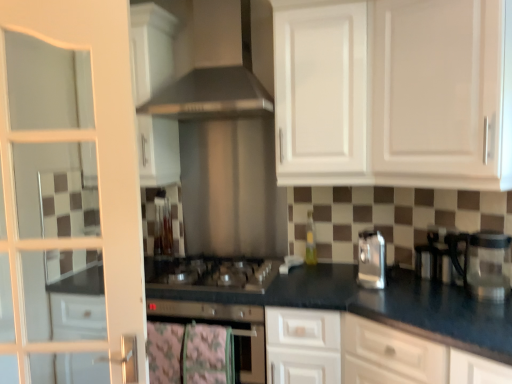
Question: Is the depth of satin silver toaster at right less than that of white glossy cabinet at upper center, acting as the first cabinetry starting from the front?

Choices:
 (A) no
 (B) yes

Answer: (A)

Question: Is satin silver toaster at right at the right side of white glossy cabinet at upper center, acting as the first cabinetry starting from the front?

Choices:
 (A) no
 (B) yes

Answer: (B)

Question: Is white glossy cabinet at upper center, marked as the 2th cabinetry in a back-to-front arrangement, surrounded by satin silver toaster at right?

Choices:
 (A) no
 (B) yes

Answer: (A)

Question: From a real-world perspective, does satin silver toaster at right sit lower than white glossy cabinet at upper center, marked as the 2th cabinetry in a back-to-front arrangement?

Choices:
 (A) yes
 (B) no

Answer: (A)

Question: Does satin silver toaster at right turn towards white glossy cabinet at upper center, marked as the 2th cabinetry in a back-to-front arrangement?

Choices:
 (A) yes
 (B) no

Answer: (B)

Question: Is white glass door at left wider or thinner than black granite countertop at center?

Choices:
 (A) thin
 (B) wide

Answer: (A)

Question: Is white glass door at left bigger or smaller than black granite countertop at center?

Choices:
 (A) small
 (B) big

Answer: (A)

Question: Is point (79, 196) positioned closer to the camera than point (401, 269)?

Choices:
 (A) farther
 (B) closer

Answer: (A)

Question: From the image's perspective, relative to black granite countertop at center, is white glass door at left above or below?

Choices:
 (A) below
 (B) above

Answer: (B)

Question: Considering the positions of white glossy cabinet at upper center, marked as the 2th cabinetry in a back-to-front arrangement, and satin silver oven at center in the image, is white glossy cabinet at upper center, marked as the 2th cabinetry in a back-to-front arrangement, wider or thinner than satin silver oven at center?

Choices:
 (A) thin
 (B) wide

Answer: (B)

Question: Looking at the image, does white glossy cabinet at upper center, marked as the 2th cabinetry in a back-to-front arrangement, seem bigger or smaller compared to satin silver oven at center?

Choices:
 (A) big
 (B) small

Answer: (A)

Question: Is point (470, 182) closer or farther from the camera than point (179, 316)?

Choices:
 (A) closer
 (B) farther

Answer: (A)

Question: Visually, is white glossy cabinet at upper center, acting as the first cabinetry starting from the front, positioned to the left or to the right of satin silver oven at center?

Choices:
 (A) right
 (B) left

Answer: (A)

Question: Is satin silver gas stove at center in front of or behind white glass door at left in the image?

Choices:
 (A) front
 (B) behind

Answer: (B)

Question: Considering the positions of satin silver gas stove at center and white glass door at left in the image, is satin silver gas stove at center taller or shorter than white glass door at left?

Choices:
 (A) short
 (B) tall

Answer: (A)